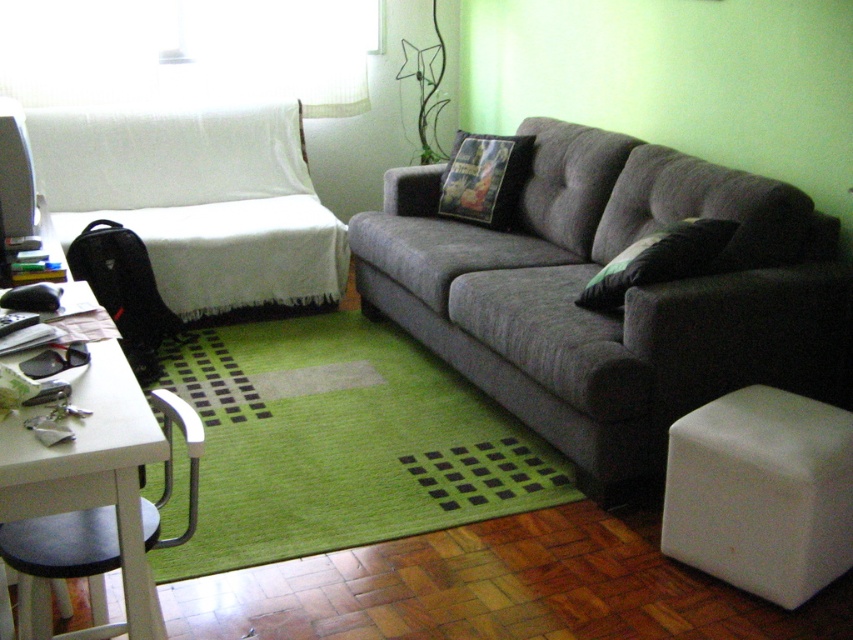
Can you confirm if gray fabric couch at center is positioned below black plastic chair at lower left?

No, gray fabric couch at center is not below black plastic chair at lower left.

Between gray fabric couch at center and black plastic chair at lower left, which one has less height?

Standing shorter between the two is black plastic chair at lower left.

Is point (535, 214) closer to viewer compared to point (86, 552)?

No.

This screenshot has width=853, height=640. Find the location of `gray fabric couch at center`. gray fabric couch at center is located at coordinates (625, 296).

Which is more to the right, black plastic chair at lower left or black fabric pillow at center?

black fabric pillow at center is more to the right.

Is point (155, 516) positioned before point (440, 204)?

Yes, point (155, 516) is in front of point (440, 204).

Locate an element on the screen. Image resolution: width=853 pixels, height=640 pixels. black plastic chair at lower left is located at coordinates (56, 557).

Does white matte stool at lower right have a larger size compared to black plastic chair at lower left?

Actually, white matte stool at lower right might be smaller than black plastic chair at lower left.

Between white matte stool at lower right and black plastic chair at lower left, which one is positioned higher?

Positioned higher is white matte stool at lower right.

Who is more distant from viewer, (834, 515) or (44, 518)?

The point (834, 515) is more distant.

The image size is (853, 640). Find the location of `white matte stool at lower right`. white matte stool at lower right is located at coordinates (761, 492).